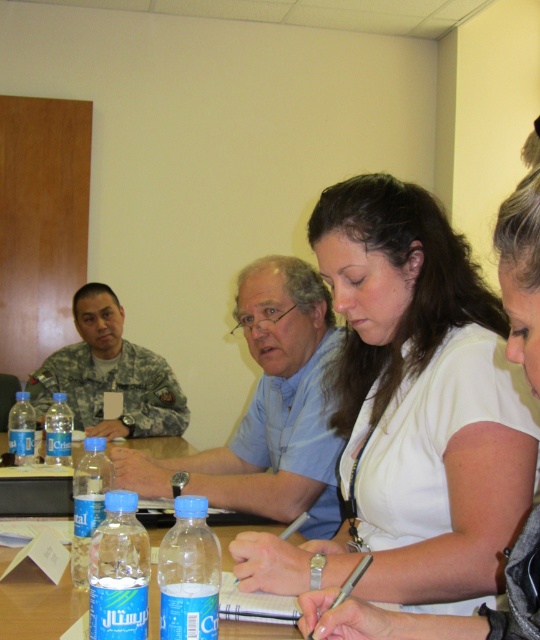
Who is taller, camouflage uniform at left or clear plastic bottles at center?

camouflage uniform at left

Describe the element at coordinates (110, 374) in the screenshot. The width and height of the screenshot is (540, 640). I see `camouflage uniform at left` at that location.

Is point (76, 349) farther from viewer compared to point (52, 502)?

Yes, it is behind point (52, 502).

The width and height of the screenshot is (540, 640). In order to click on camouflage uniform at left in this screenshot , I will do `click(110, 374)`.

Can you confirm if white matte shirt at center is shorter than clear plastic bottle at lower left?

Incorrect, white matte shirt at center's height does not fall short of clear plastic bottle at lower left's.

Between white matte shirt at center and clear plastic bottle at lower left, which one is positioned lower?

Positioned lower is clear plastic bottle at lower left.

The width and height of the screenshot is (540, 640). What do you see at coordinates (411, 410) in the screenshot? I see `white matte shirt at center` at bounding box center [411, 410].

Image resolution: width=540 pixels, height=640 pixels. I want to click on white matte shirt at center, so coord(411,410).

In the scene shown: Who is positioned more to the right, clear plastic bottle at left or blue plastic bottle at lower left?

clear plastic bottle at left is more to the right.

Identify the location of clear plastic bottle at left. Image resolution: width=540 pixels, height=640 pixels. (58, 432).

At what (x,y) coordinates should I click in order to perform the action: click on clear plastic bottle at left. Please return your answer as a coordinate pair (x, y). Image resolution: width=540 pixels, height=640 pixels. Looking at the image, I should click on (58, 432).